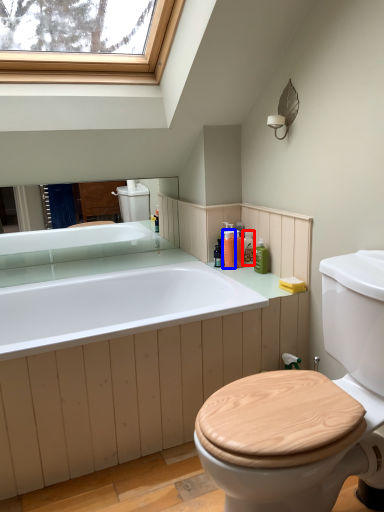
Question: Which point is further to the camera, toiletry (highlighted by a red box) or toiletry (highlighted by a blue box)?

Choices:
 (A) toiletry
 (B) toiletry

Answer: (A)